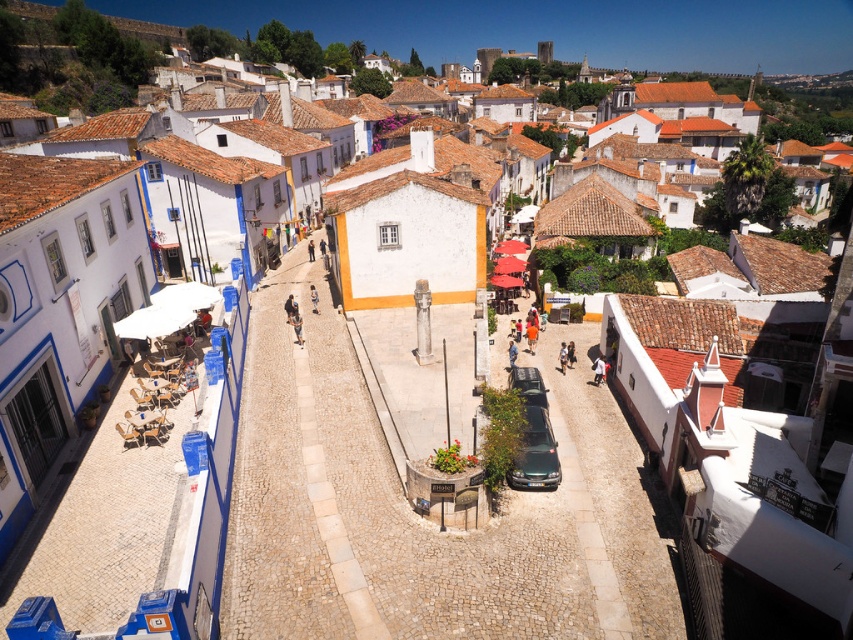
Does metallic green car at center have a greater width compared to metallic gray car at center?

Yes.

Which is in front, point (549, 472) or point (531, 380)?

Point (549, 472) is in front.

At what (x,y) coordinates should I click in order to perform the action: click on metallic green car at center. Please return your answer as a coordinate pair (x, y). Looking at the image, I should click on (537, 452).